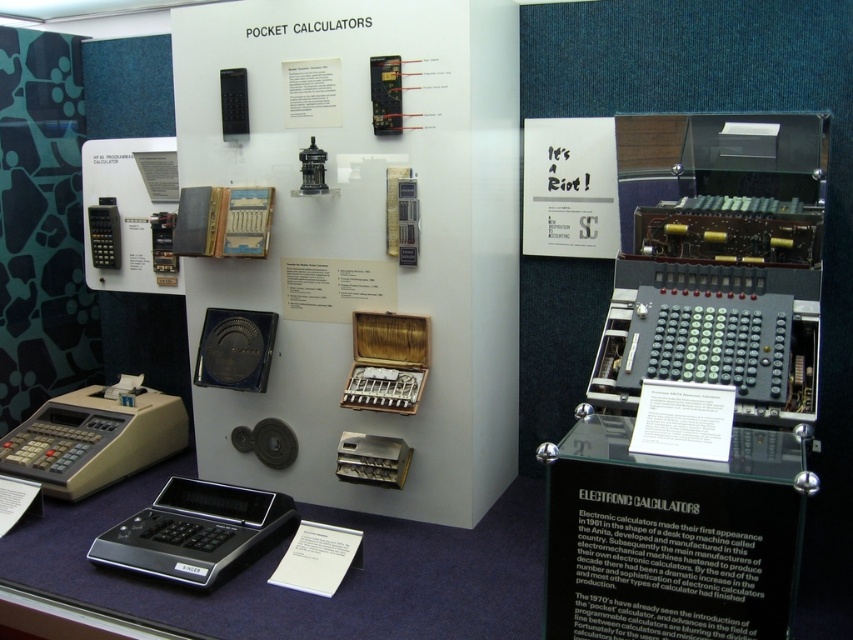
Is beige plastic cash register at lower left thinner than black plastic calculator at lower left?

No, beige plastic cash register at lower left is not thinner than black plastic calculator at lower left.

Is beige plastic cash register at lower left wider than black plastic calculator at lower left?

Yes, beige plastic cash register at lower left is wider than black plastic calculator at lower left.

What are the coordinates of `beige plastic cash register at lower left` in the screenshot? It's located at (94, 436).